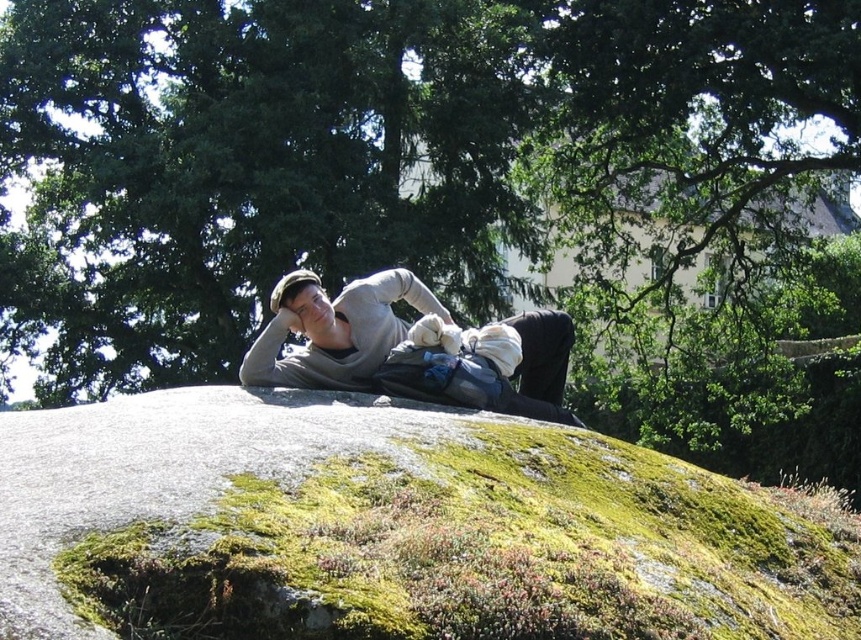
You are a hiker who wants to take a nap in the shade. You see the green leafy tree at upper center and the green mossy rock at center. Which one provides more shade?

The green leafy tree at upper center is bigger than the green mossy rock at center, so it provides more shade.

You are a hiker who wants to place your gray cotton sweater at center on a flat surface. You see the green leafy tree at upper center. Which direction should you move relative to the tree to find a suitable spot?

→ You should move to the right of the green leafy tree at upper center because the gray cotton sweater at center is already positioned to the right of the tree, indicating that area might have a flat surface.